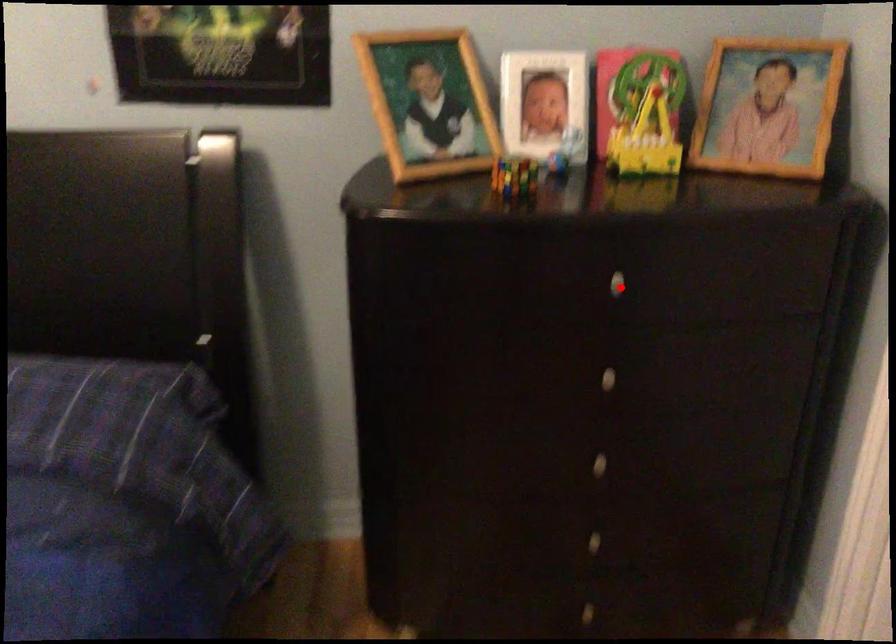
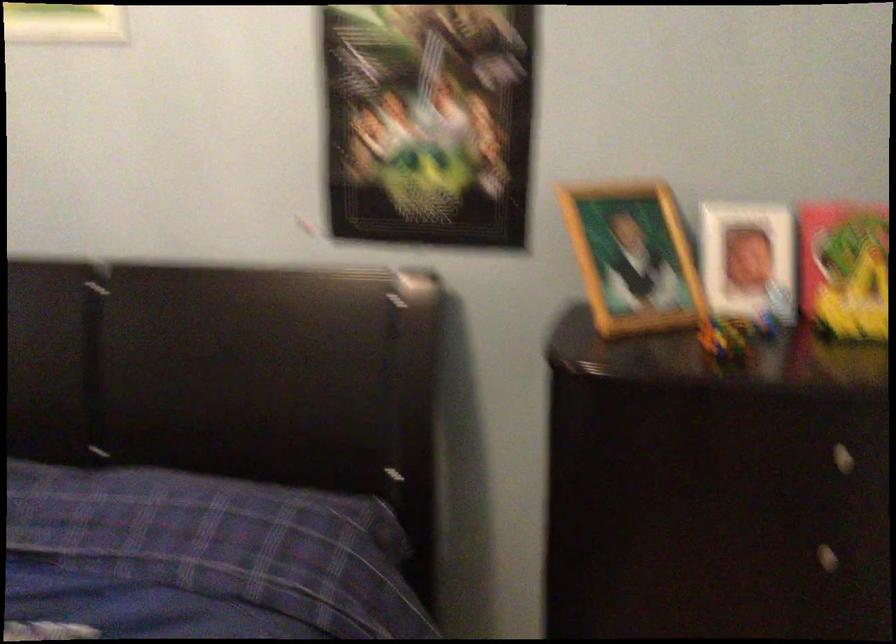
Where in the second image is the point corresponding to the highlighted location from the first image?

(840, 458)